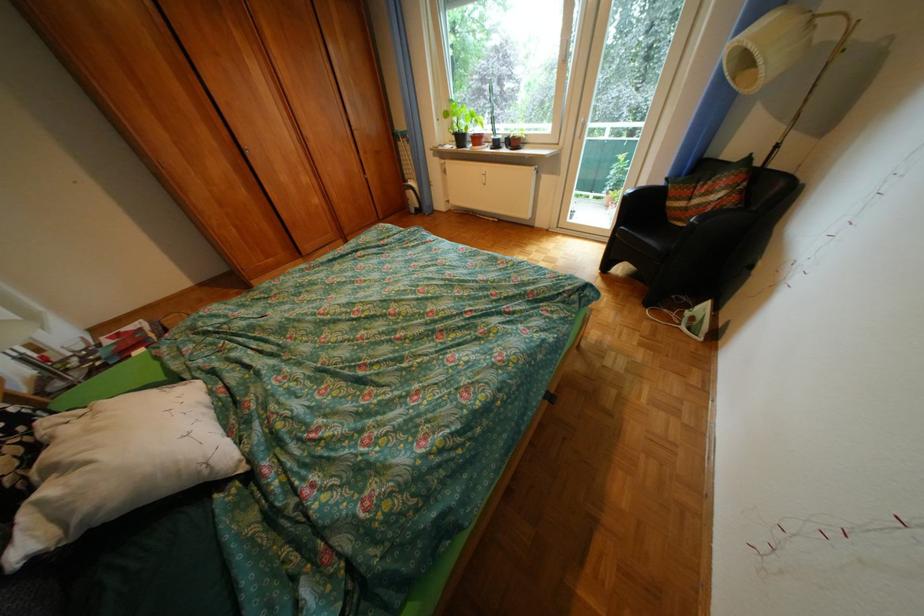
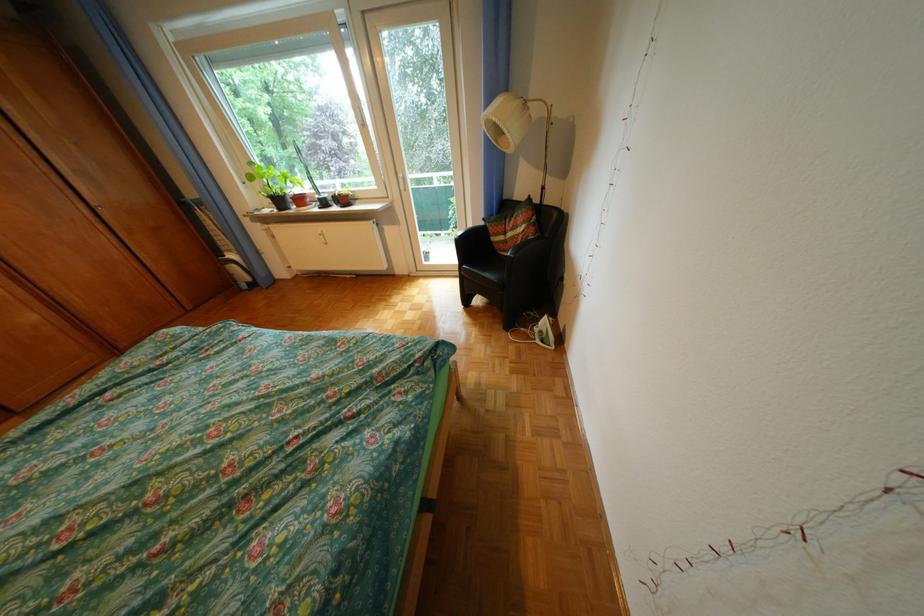
Question: The camera is either moving clockwise (left) or counter-clockwise (right) around the object. The first image is from the beginning of the video and the second image is from the end. Is the camera moving left or right when shooting the video?

Choices:
 (A) Left
 (B) Right

Answer: (A)